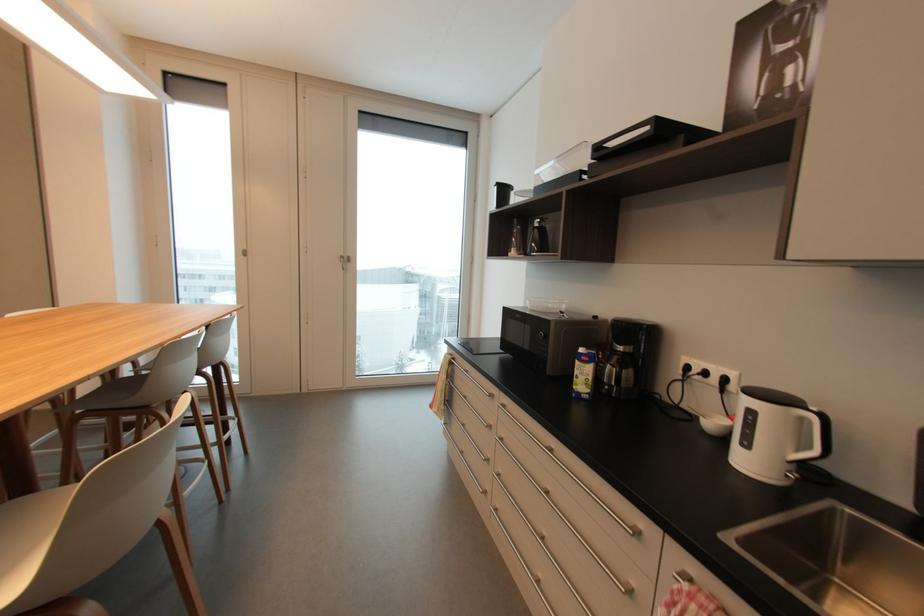
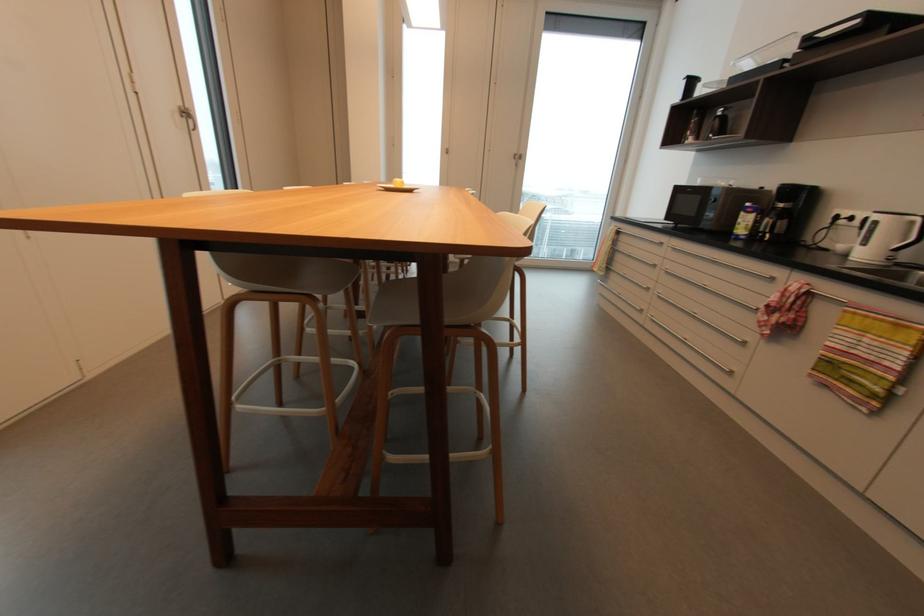
Find the pixel in the second image that matches pixel 808 419 in the first image.

(916, 223)